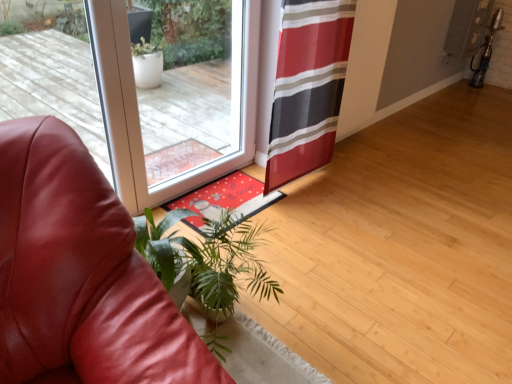
Question: From the image's perspective, is leather couch at lower left over transparent glass door at center?

Choices:
 (A) yes
 (B) no

Answer: (B)

Question: Considering the relative sizes of leather couch at lower left and transparent glass door at center in the image provided, is leather couch at lower left bigger than transparent glass door at center?

Choices:
 (A) no
 (B) yes

Answer: (B)

Question: Considering the relative sizes of leather couch at lower left and transparent glass door at center in the image provided, is leather couch at lower left wider than transparent glass door at center?

Choices:
 (A) yes
 (B) no

Answer: (A)

Question: Considering the relative positions of leather couch at lower left and transparent glass door at center in the image provided, is leather couch at lower left to the right of transparent glass door at center from the viewer's perspective?

Choices:
 (A) no
 (B) yes

Answer: (A)

Question: Is leather couch at lower left smaller than transparent glass door at center?

Choices:
 (A) no
 (B) yes

Answer: (A)

Question: Considering the relative sizes of leather couch at lower left and transparent glass door at center in the image provided, is leather couch at lower left taller than transparent glass door at center?

Choices:
 (A) yes
 (B) no

Answer: (B)

Question: From a real-world perspective, is transparent glass door at center positioned under green leafy plant at lower left based on gravity?

Choices:
 (A) yes
 (B) no

Answer: (B)

Question: Is transparent glass door at center beside green leafy plant at lower left?

Choices:
 (A) no
 (B) yes

Answer: (A)

Question: Is transparent glass door at center not close to green leafy plant at lower left?

Choices:
 (A) no
 (B) yes

Answer: (A)

Question: Can you confirm if transparent glass door at center is thinner than green leafy plant at lower left?

Choices:
 (A) no
 (B) yes

Answer: (B)

Question: Is green leafy plant at lower left surrounded by transparent glass door at center?

Choices:
 (A) no
 (B) yes

Answer: (A)

Question: Is transparent glass door at center looking in the opposite direction of green leafy plant at lower left?

Choices:
 (A) yes
 (B) no

Answer: (B)

Question: Does red and black striped curtain at center appear on the left side of leather couch at lower left?

Choices:
 (A) no
 (B) yes

Answer: (A)